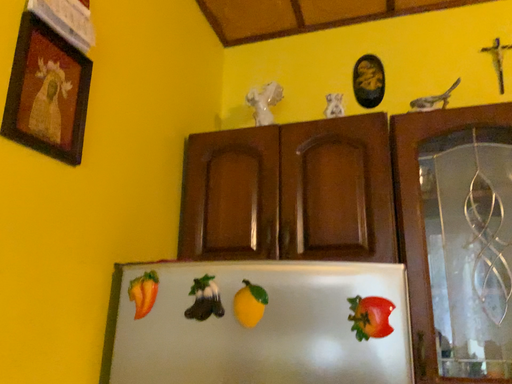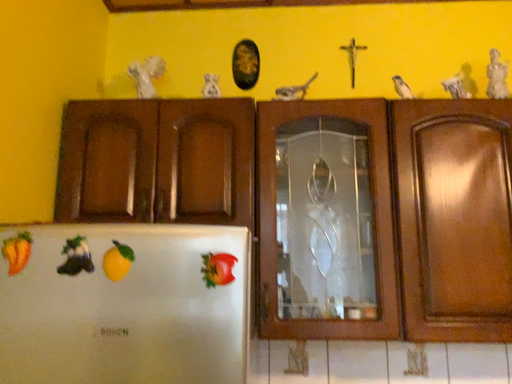
Question: Which way did the camera rotate in the video?

Choices:
 (A) rotated right
 (B) rotated left

Answer: (A)